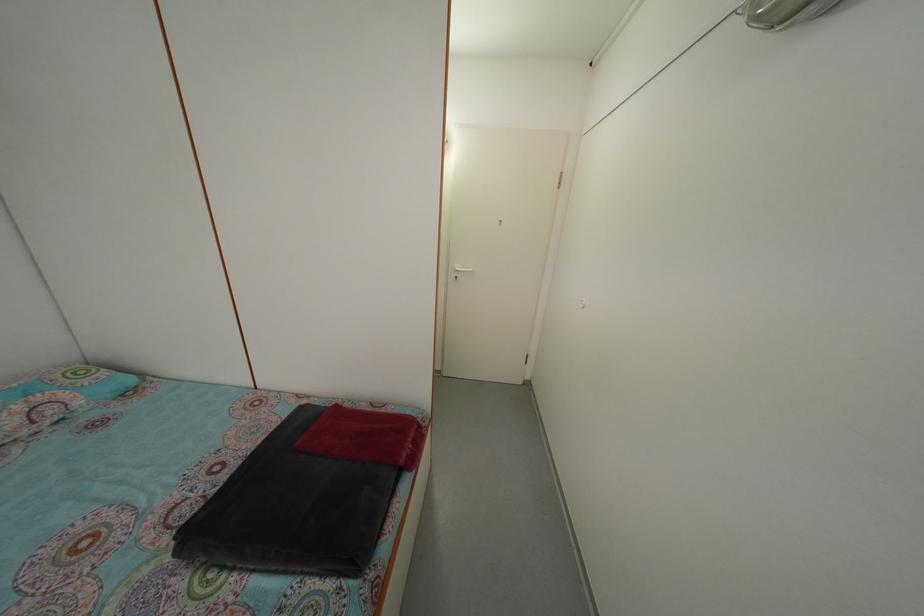
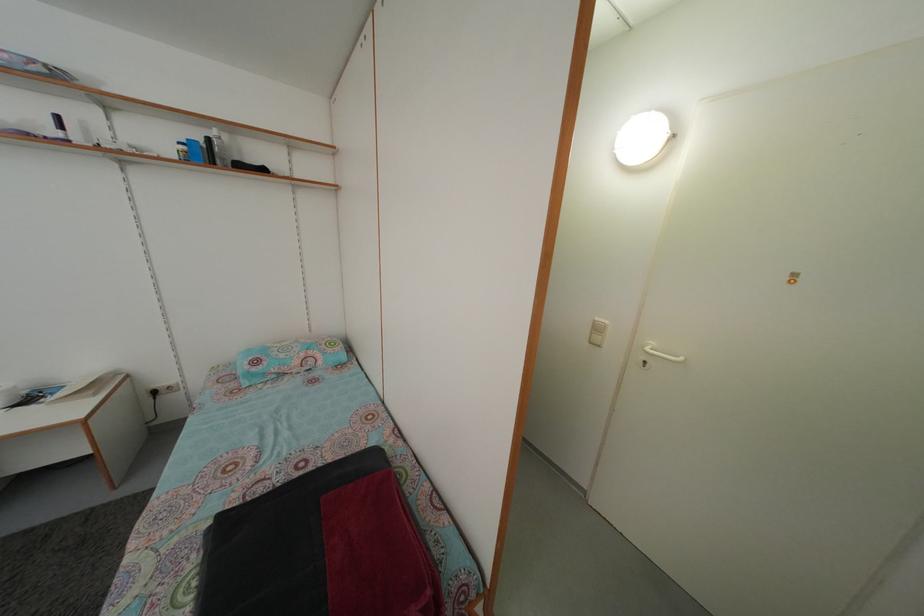
Question: The first image is from the beginning of the video and the second image is from the end. How did the camera likely rotate when shooting the video?

Choices:
 (A) Left
 (B) Right
 (C) Up
 (D) Down

Answer: (A)